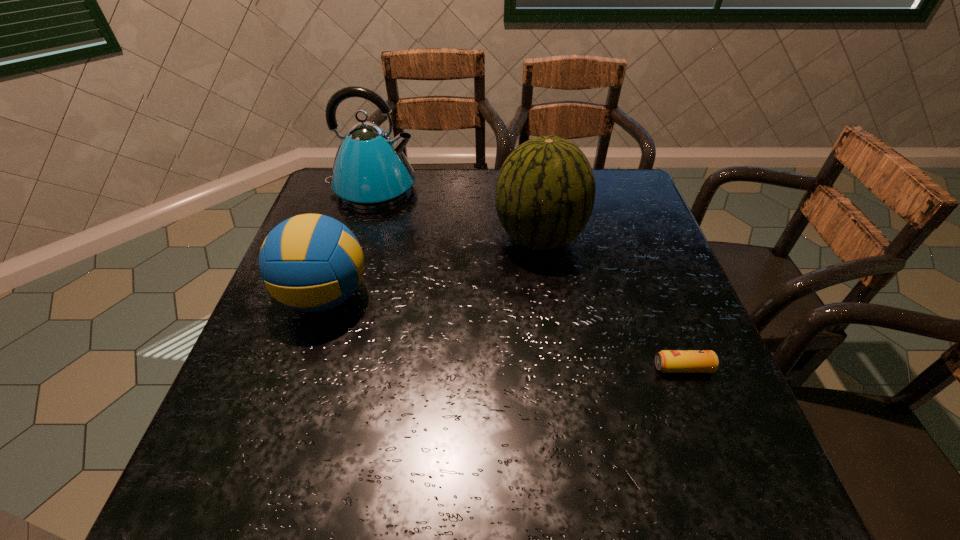
Locate an element on the screen. This screenshot has height=540, width=960. the third closest object to the kettle is located at coordinates point(668,361).

The width and height of the screenshot is (960, 540). I want to click on vacant space that satisfies the following two spatial constraints: 1. at the spout of the kettle; 2. on the right side of the nearest object, so click(x=319, y=368).

In order to click on vacant region that satisfies the following two spatial constraints: 1. at the spout of the kettle; 2. on the left side of the watermelon in this screenshot , I will do `click(358, 238)`.

This screenshot has height=540, width=960. I want to click on vacant region that satisfies the following two spatial constraints: 1. at the spout of the kettle; 2. on the right side of the shortest object, so click(x=319, y=368).

Where is `vacant space that satisfies the following two spatial constraints: 1. at the spout of the kettle; 2. on the back side of the rightmost object`? The height and width of the screenshot is (540, 960). vacant space that satisfies the following two spatial constraints: 1. at the spout of the kettle; 2. on the back side of the rightmost object is located at coordinates (319, 368).

Locate an element on the screen. free location that satisfies the following two spatial constraints: 1. at the spout of the kettle; 2. on the left side of the third object from left to right is located at coordinates pyautogui.click(x=358, y=238).

Locate an element on the screen. This screenshot has width=960, height=540. vacant point that satisfies the following two spatial constraints: 1. on the front side of the shortest object; 2. on the right side of the watermelon is located at coordinates (559, 368).

I want to click on vacant area in the image that satisfies the following two spatial constraints: 1. at the spout of the third object from left to right; 2. on the right side of the kettle, so click(x=358, y=238).

At what (x,y) coordinates should I click in order to perform the action: click on free spot that satisfies the following two spatial constraints: 1. at the spout of the second object from right to left; 2. on the left side of the kettle. Please return your answer as a coordinate pair (x, y). This screenshot has width=960, height=540. Looking at the image, I should click on (358, 238).

This screenshot has height=540, width=960. In order to click on free point that satisfies the following two spatial constraints: 1. at the spout of the kettle; 2. on the front side of the third tallest object in this screenshot , I will do `click(340, 296)`.